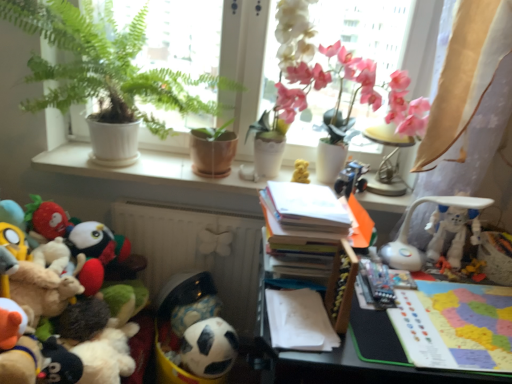
This screenshot has height=384, width=512. I want to click on empty space that is ontop of white paper at center, so click(x=304, y=318).